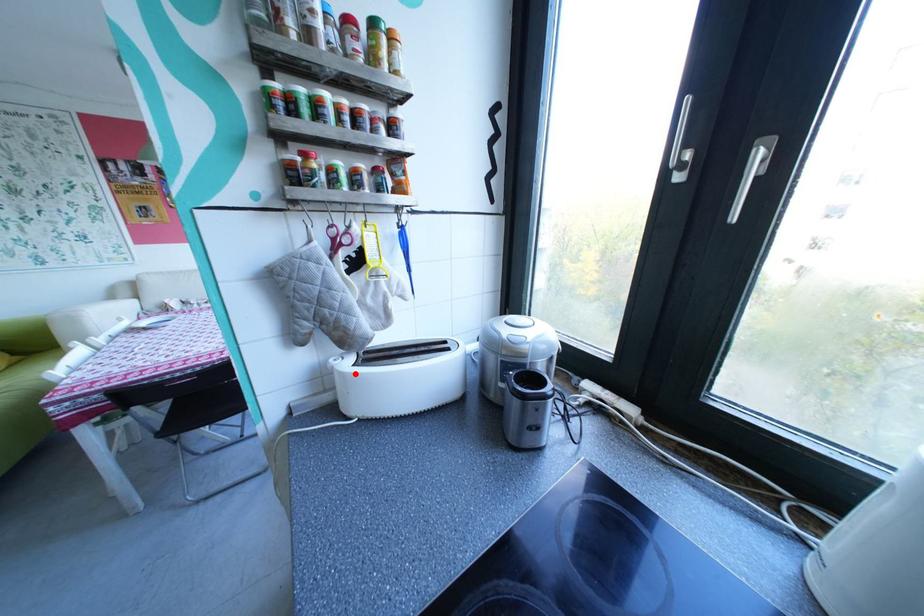
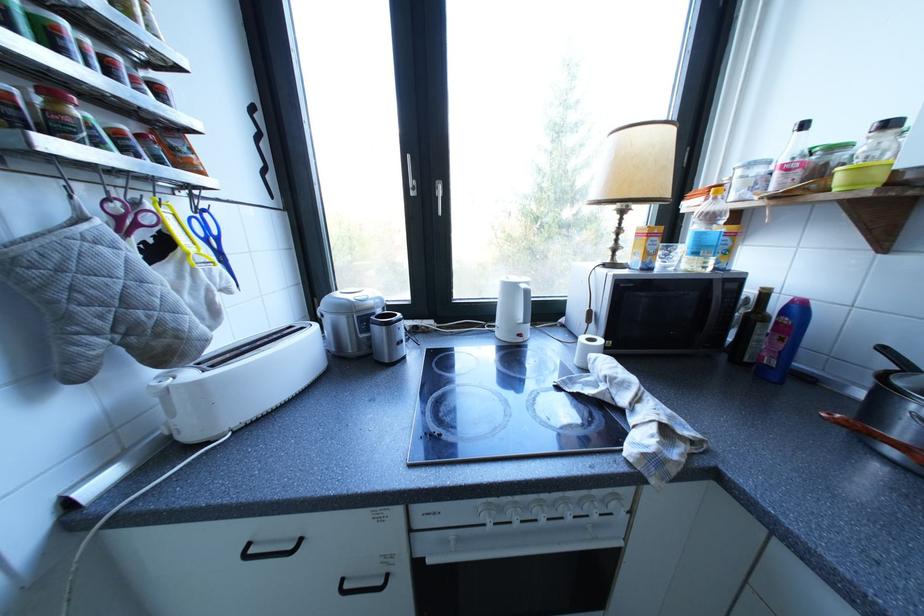
Question: I am providing you with two images of the same scene from different viewpoints. A red point is marked on the first image. Can you still see the location of the red point in image 2?

Choices:
 (A) Yes
 (B) No

Answer: (A)